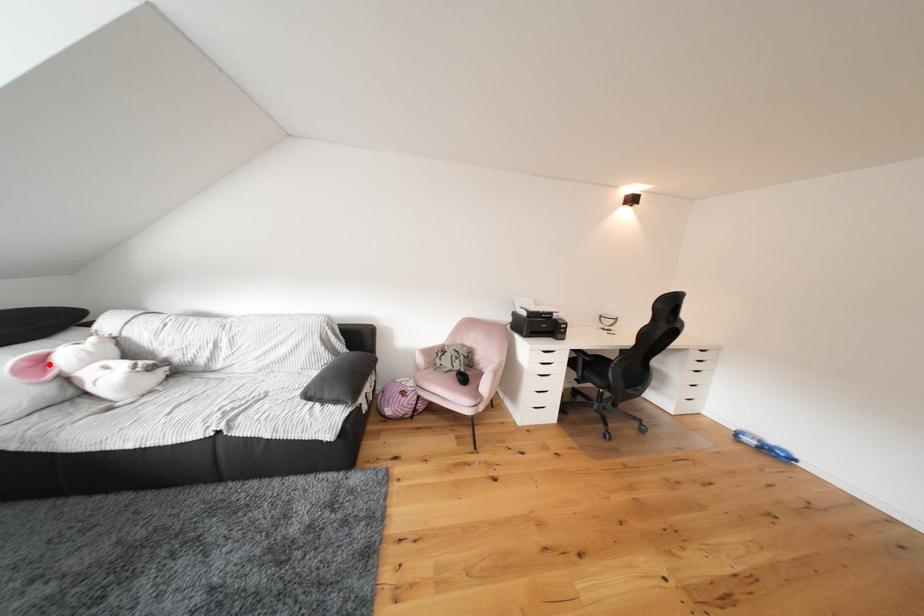
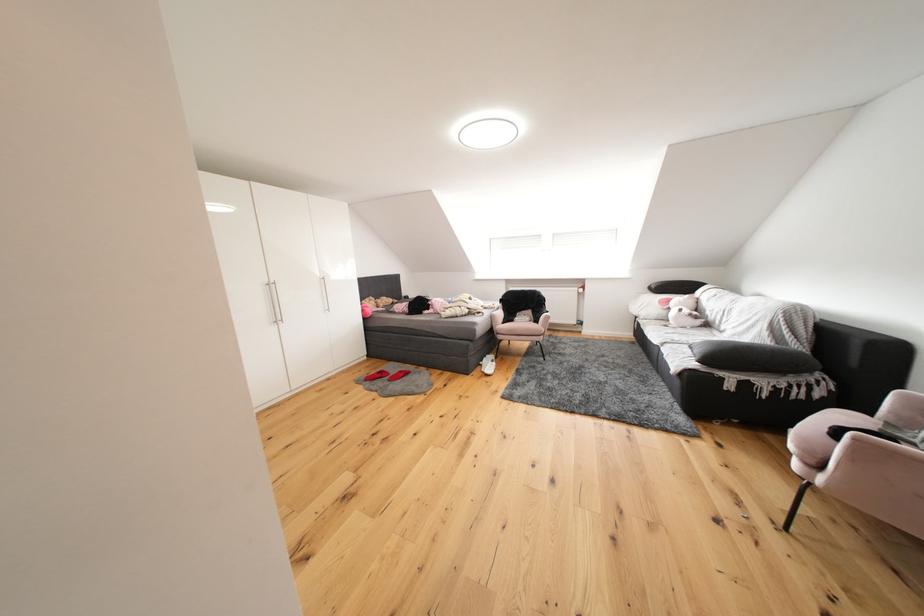
Question: I am providing you with two images of the same scene from different viewpoints. A red point is marked on the first image. Is the red point's position out of view in image 2?

Choices:
 (A) Yes
 (B) No

Answer: (B)